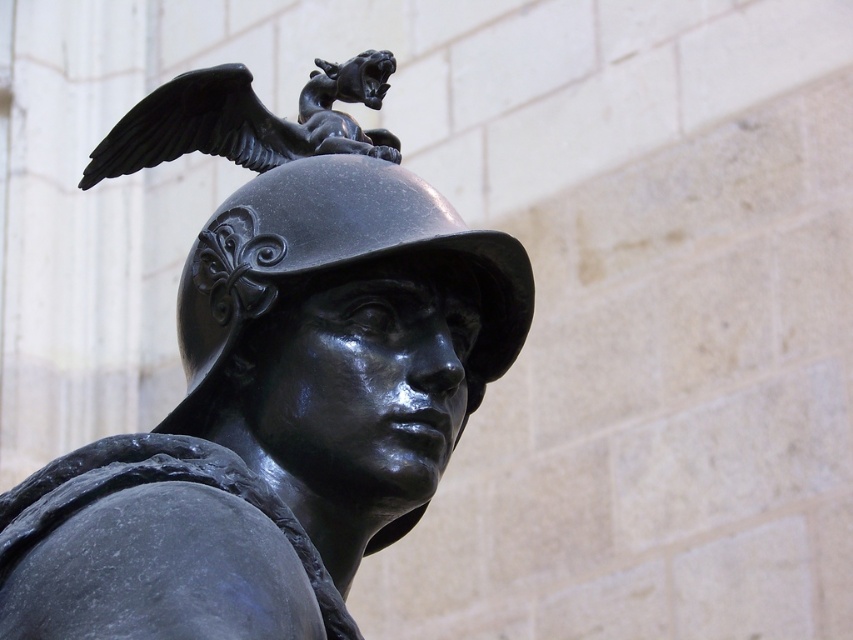
Question: Which point is farther to the camera?

Choices:
 (A) pos(292,163)
 (B) pos(312,264)
 (C) pos(268,120)

Answer: (C)

Question: Is bronze helmet at center positioned at the back of shiny black helmet at center?

Choices:
 (A) no
 (B) yes

Answer: (A)

Question: Estimate the real-world distances between objects in this image. Which object is farther from the shiny black helmet at center?

Choices:
 (A) bronze helmet at center
 (B) polished bronze eagle at upper center

Answer: (B)

Question: Is bronze helmet at center thinner than shiny black helmet at center?

Choices:
 (A) yes
 (B) no

Answer: (B)

Question: Among these points, which one is farthest from the camera?

Choices:
 (A) (397, 172)
 (B) (241, 188)
 (C) (134, 168)

Answer: (B)

Question: Is bronze helmet at center to the left of shiny black helmet at center from the viewer's perspective?

Choices:
 (A) no
 (B) yes

Answer: (B)